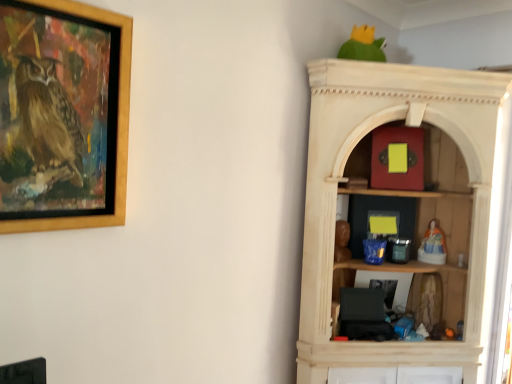
Question: Is porcelain figurine at right, arranged as the first toy when viewed from the right, completely or partially outside of green matte parrot at upper center?

Choices:
 (A) yes
 (B) no

Answer: (A)

Question: From a real-world perspective, is porcelain figurine at right, which ranks as the 4th toy in left-to-right order, physically above green matte parrot at upper center?

Choices:
 (A) yes
 (B) no

Answer: (B)

Question: Are porcelain figurine at right, arranged as the first toy when viewed from the right, and green matte parrot at upper center making contact?

Choices:
 (A) yes
 (B) no

Answer: (B)

Question: Does porcelain figurine at right, arranged as the first toy when viewed from the right, lie behind green matte parrot at upper center?

Choices:
 (A) yes
 (B) no

Answer: (A)

Question: Is porcelain figurine at right, which ranks as the 4th toy in left-to-right order, surrounding green matte parrot at upper center?

Choices:
 (A) yes
 (B) no

Answer: (B)

Question: Is porcelain figurine at right, arranged as the first toy when viewed from the right, wider than green matte parrot at upper center?

Choices:
 (A) no
 (B) yes

Answer: (A)

Question: Is matte red box at upper center, the 4th toy ordered from the bottom, shorter than fuzzy fabric doll at right, which appears as the 1th toy when ordered from the bottom?

Choices:
 (A) yes
 (B) no

Answer: (B)

Question: Is matte red box at upper center, marked as the 3th toy in a right-to-left arrangement, facing towards fuzzy fabric doll at right, placed as the 3th toy when sorted from left to right?

Choices:
 (A) yes
 (B) no

Answer: (B)

Question: Does matte red box at upper center, acting as the second toy starting from the left, have a lesser width compared to fuzzy fabric doll at right, the 4th toy from the top?

Choices:
 (A) no
 (B) yes

Answer: (B)

Question: From a real-world perspective, is matte red box at upper center, the 4th toy ordered from the bottom, located beneath fuzzy fabric doll at right, which appears as the 1th toy when ordered from the bottom?

Choices:
 (A) yes
 (B) no

Answer: (B)

Question: Is matte red box at upper center, the 4th toy ordered from the bottom, taller than fuzzy fabric doll at right, placed as the 3th toy when sorted from left to right?

Choices:
 (A) no
 (B) yes

Answer: (B)

Question: Is matte red box at upper center, acting as the second toy starting from the left, smaller than fuzzy fabric doll at right, which is the second toy from right to left?

Choices:
 (A) no
 (B) yes

Answer: (A)

Question: Considering the relative sizes of fuzzy fabric doll at right, placed as the 3th toy when sorted from left to right, and matte red box at upper center, marked as the 3th toy in a right-to-left arrangement, in the image provided, is fuzzy fabric doll at right, placed as the 3th toy when sorted from left to right, shorter than matte red box at upper center, marked as the 3th toy in a right-to-left arrangement,?

Choices:
 (A) yes
 (B) no

Answer: (A)